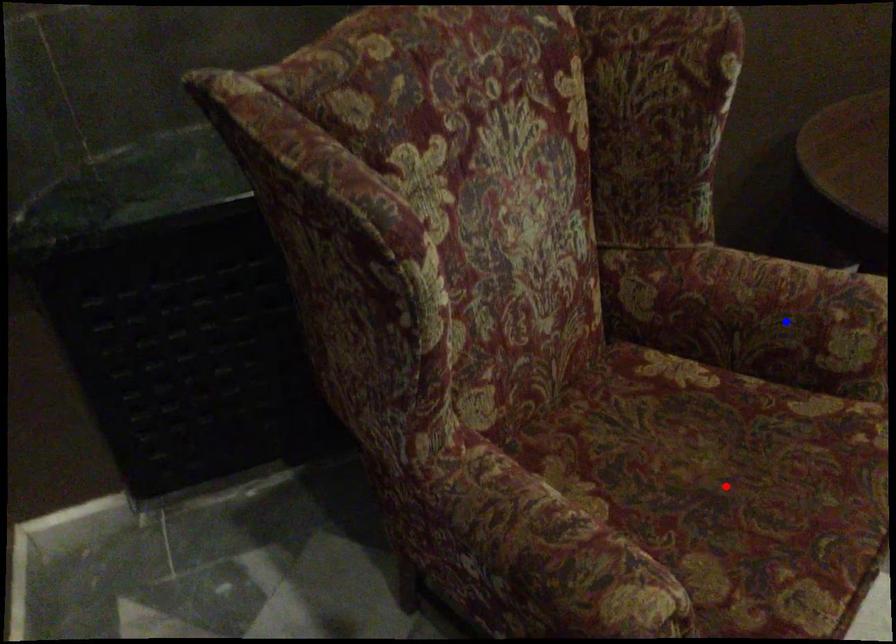
Question: Two points are marked on the image. Which point is closer to the camera?

Choices:
 (A) Blue point is closer.
 (B) Red point is closer.

Answer: (B)